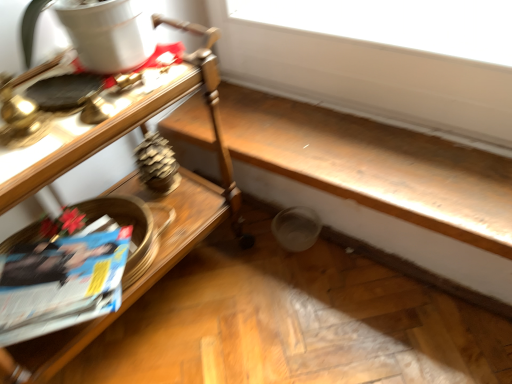
Question: Should I look upward or downward to see wooden table at left?

Choices:
 (A) up
 (B) down

Answer: (B)

Question: From a real-world perspective, is blue glossy magazine at lower left physically above wooden table at left?

Choices:
 (A) no
 (B) yes

Answer: (A)

Question: Is blue glossy magazine at lower left thinner than wooden table at left?

Choices:
 (A) no
 (B) yes

Answer: (B)

Question: From the image's perspective, is blue glossy magazine at lower left on top of wooden table at left?

Choices:
 (A) no
 (B) yes

Answer: (A)

Question: Considering the relative sizes of blue glossy magazine at lower left and wooden table at left in the image provided, is blue glossy magazine at lower left wider than wooden table at left?

Choices:
 (A) yes
 (B) no

Answer: (B)

Question: Is blue glossy magazine at lower left to the left of wooden table at left from the viewer's perspective?

Choices:
 (A) yes
 (B) no

Answer: (A)

Question: Is the position of blue glossy magazine at lower left more distant than that of wooden table at left?

Choices:
 (A) yes
 (B) no

Answer: (A)

Question: Are wooden table at left and blue glossy magazine at lower left making contact?

Choices:
 (A) yes
 (B) no

Answer: (B)

Question: Is wooden table at left oriented away from blue glossy magazine at lower left?

Choices:
 (A) yes
 (B) no

Answer: (A)

Question: Is wooden table at left to the right of blue glossy magazine at lower left from the viewer's perspective?

Choices:
 (A) yes
 (B) no

Answer: (A)

Question: Does wooden table at left have a smaller size compared to blue glossy magazine at lower left?

Choices:
 (A) no
 (B) yes

Answer: (A)

Question: Does wooden table at left have a greater height compared to blue glossy magazine at lower left?

Choices:
 (A) yes
 (B) no

Answer: (A)

Question: Is wooden table at left not within blue glossy magazine at lower left?

Choices:
 (A) no
 (B) yes

Answer: (B)

Question: Is wooden table at left bigger or smaller than blue glossy magazine at lower left?

Choices:
 (A) small
 (B) big

Answer: (B)